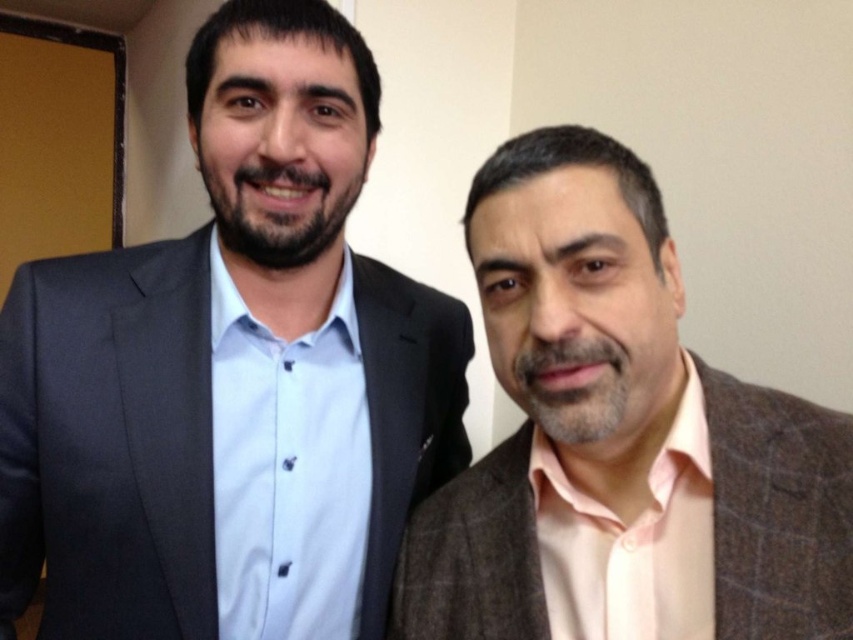
Does matte black suit at left have a larger size compared to brown textured suit at right?

Indeed, matte black suit at left has a larger size compared to brown textured suit at right.

Does matte black suit at left have a lesser width compared to brown textured suit at right?

In fact, matte black suit at left might be wider than brown textured suit at right.

At what (x,y) coordinates should I click in order to perform the action: click on matte black suit at left. Please return your answer as a coordinate pair (x, y). Image resolution: width=853 pixels, height=640 pixels. Looking at the image, I should click on (231, 374).